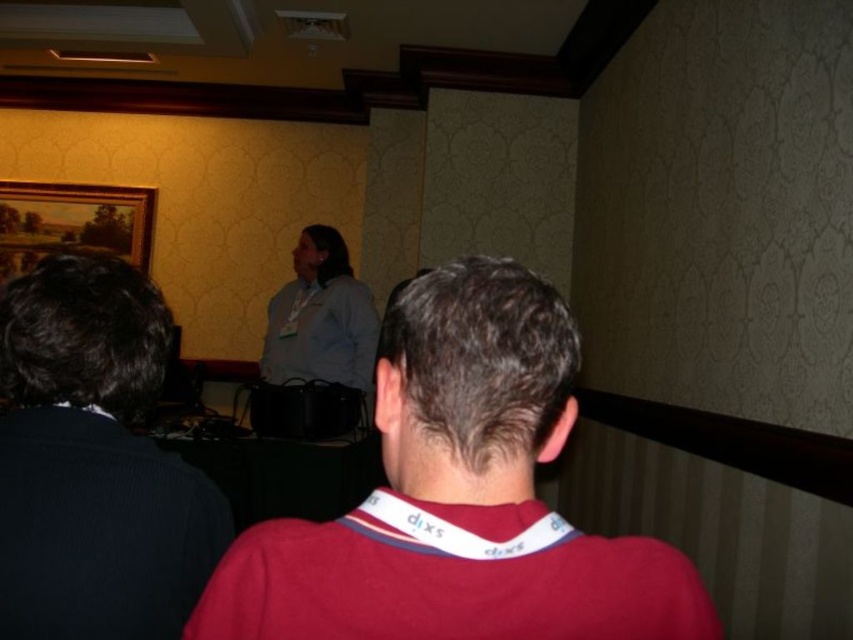
You are a photographer in the audience of this presentation. You want to take a photo of both the dark blue sweater at left and the light blue shirt at center. Which one will appear larger in your photo?

The dark blue sweater at left will appear larger in the photo because it is closer to the viewer than the light blue shirt at center.